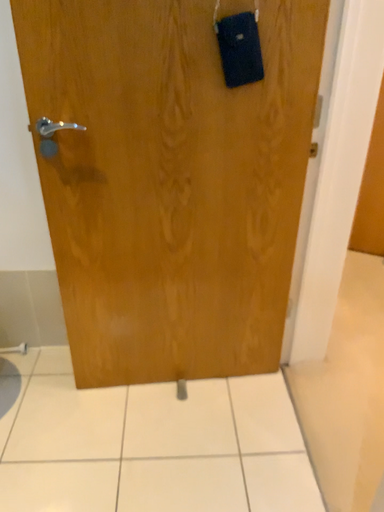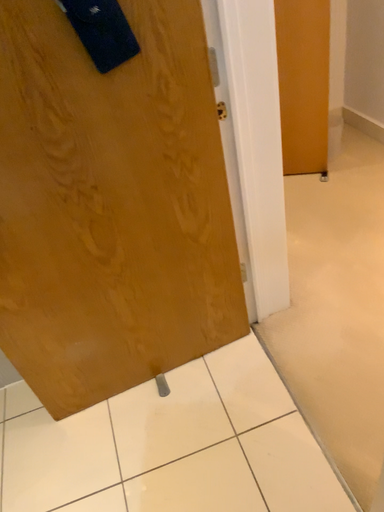
Question: Which way did the camera rotate in the video?

Choices:
 (A) rotated downward
 (B) rotated upward

Answer: (A)